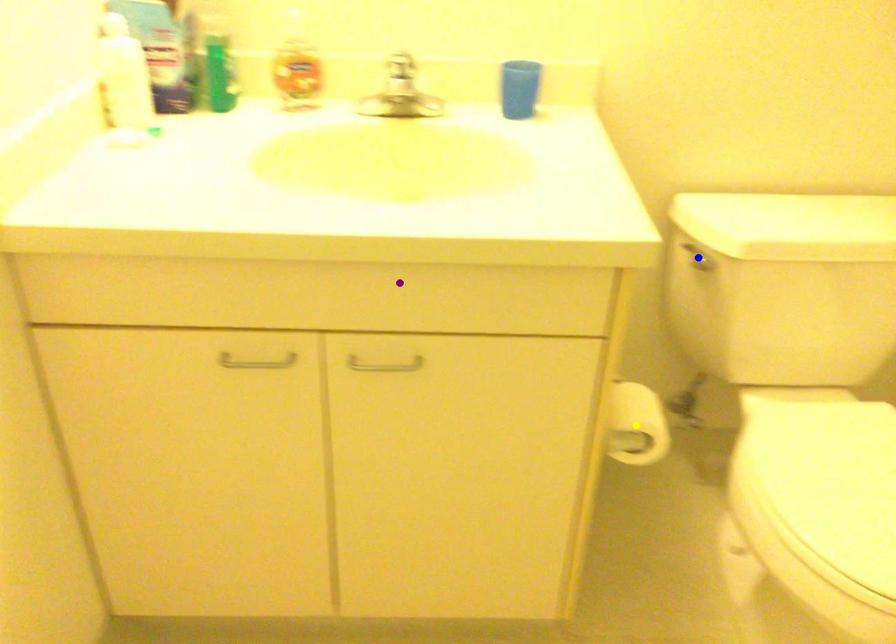
Order these from nearest to farthest:
blue point
yellow point
purple point

purple point → yellow point → blue point